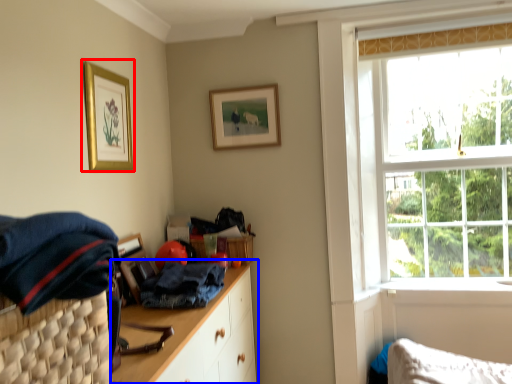
Question: Among these objects, which one is nearest to the camera, picture frame (highlighted by a red box) or cabinetry (highlighted by a blue box)?

Choices:
 (A) picture frame
 (B) cabinetry

Answer: (B)